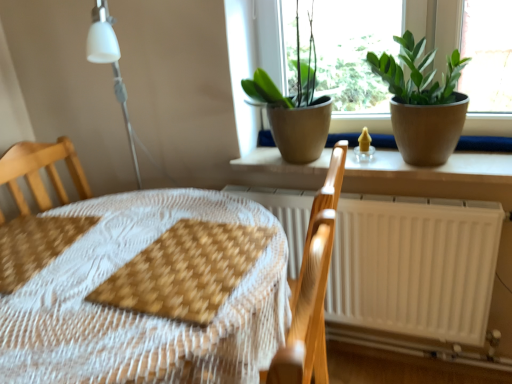
Question: Considering the relative positions of green matte plant at upper center, placed as the second houseplant when sorted from right to left, and brown woven placemat at lower left, arranged as the 2th sheet when viewed from the right, in the image provided, is green matte plant at upper center, placed as the second houseplant when sorted from right to left, to the left of brown woven placemat at lower left, arranged as the 2th sheet when viewed from the right, from the viewer's perspective?

Choices:
 (A) no
 (B) yes

Answer: (A)

Question: Is green matte plant at upper center, placed as the second houseplant when sorted from right to left, located outside brown woven placemat at lower left, arranged as the 2th sheet when viewed from the right?

Choices:
 (A) yes
 (B) no

Answer: (A)

Question: Is green matte plant at upper center, which appears as the first houseplant when viewed from the left, thinner than brown woven placemat at lower left, placed as the first sheet when sorted from left to right?

Choices:
 (A) no
 (B) yes

Answer: (B)

Question: Can you confirm if green matte plant at upper center, placed as the second houseplant when sorted from right to left, is positioned to the right of brown woven placemat at lower left, placed as the first sheet when sorted from left to right?

Choices:
 (A) yes
 (B) no

Answer: (A)

Question: Is green matte plant at upper center, placed as the second houseplant when sorted from right to left, shorter than brown woven placemat at lower left, arranged as the 2th sheet when viewed from the right?

Choices:
 (A) no
 (B) yes

Answer: (A)

Question: In terms of height, does green matte plant at upper center, placed as the second houseplant when sorted from right to left, look taller or shorter compared to brown woven placemat at lower left, placed as the first sheet when sorted from left to right?

Choices:
 (A) tall
 (B) short

Answer: (A)

Question: Is green matte plant at upper center, placed as the second houseplant when sorted from right to left, wider or thinner than brown woven placemat at lower left, placed as the first sheet when sorted from left to right?

Choices:
 (A) wide
 (B) thin

Answer: (B)

Question: Based on their sizes in the image, would you say green matte plant at upper center, placed as the second houseplant when sorted from right to left, is bigger or smaller than brown woven placemat at lower left, arranged as the 2th sheet when viewed from the right?

Choices:
 (A) small
 (B) big

Answer: (B)

Question: From the image's perspective, relative to brown woven placemat at lower left, arranged as the 2th sheet when viewed from the right, is green matte plant at upper center, which appears as the first houseplant when viewed from the left, above or below?

Choices:
 (A) below
 (B) above

Answer: (B)

Question: Based on their sizes in the image, would you say brown woven placemat at center, which is the first sheet in right-to-left order, is bigger or smaller than green matte plant at upper right, positioned as the first houseplant in right-to-left order?

Choices:
 (A) big
 (B) small

Answer: (B)

Question: Based on their positions, is brown woven placemat at center, which is the first sheet in right-to-left order, located to the left or right of green matte plant at upper right, the 2th houseplant viewed from the left?

Choices:
 (A) right
 (B) left

Answer: (B)

Question: Is brown woven placemat at center, which is the first sheet in right-to-left order, situated inside green matte plant at upper right, positioned as the first houseplant in right-to-left order, or outside?

Choices:
 (A) inside
 (B) outside

Answer: (B)

Question: Considering their positions, is brown woven placemat at center, arranged as the 2th sheet when viewed from the left, located in front of or behind green matte plant at upper right, positioned as the first houseplant in right-to-left order?

Choices:
 (A) front
 (B) behind

Answer: (A)

Question: Considering the relative positions of brown woven placemat at center, arranged as the 2th sheet when viewed from the left, and wooden placemat at center in the image provided, is brown woven placemat at center, arranged as the 2th sheet when viewed from the left, to the left or to the right of wooden placemat at center?

Choices:
 (A) right
 (B) left

Answer: (A)

Question: From a real-world perspective, is brown woven placemat at center, which is the first sheet in right-to-left order, positioned above or below wooden placemat at center?

Choices:
 (A) below
 (B) above

Answer: (B)